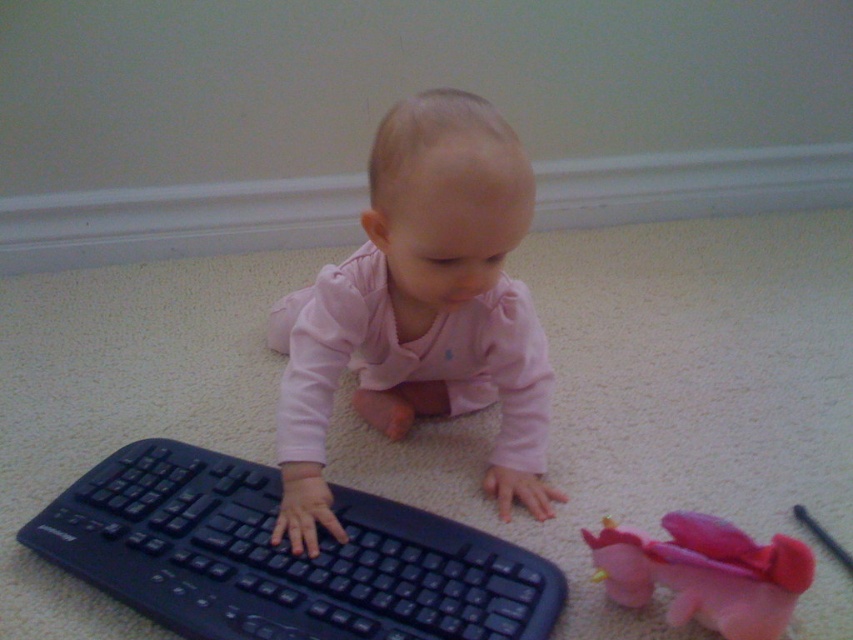
Question: Estimate the real-world distances between objects in this image. Which object is farther from the pink fabric dragon at lower right?

Choices:
 (A) pink matte baby at center
 (B) black plastic keyboard at center

Answer: (A)

Question: Does pink matte baby at center appear under pink fabric dragon at lower right?

Choices:
 (A) no
 (B) yes

Answer: (A)

Question: Can you confirm if pink matte baby at center is wider than pink fabric dragon at lower right?

Choices:
 (A) yes
 (B) no

Answer: (A)

Question: Among these objects, which one is nearest to the camera?

Choices:
 (A) pink matte baby at center
 (B) black plastic keyboard at center
 (C) pink fabric dragon at lower right

Answer: (C)

Question: Among these objects, which one is farthest from the camera?

Choices:
 (A) pink fabric dragon at lower right
 (B) black plastic keyboard at center

Answer: (B)

Question: Is black plastic keyboard at center above pink fabric dragon at lower right?

Choices:
 (A) yes
 (B) no

Answer: (A)